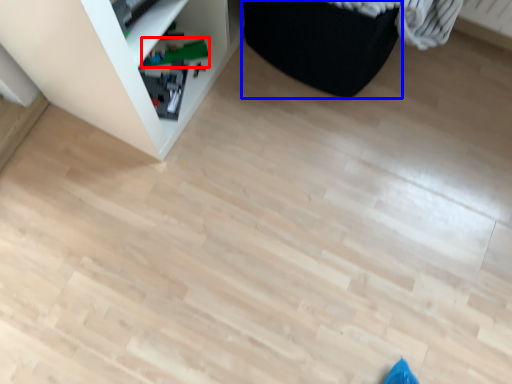
Question: Which of the following is the farthest to the observer, toy (highlighted by a red box) or furniture (highlighted by a blue box)?

Choices:
 (A) toy
 (B) furniture

Answer: (A)